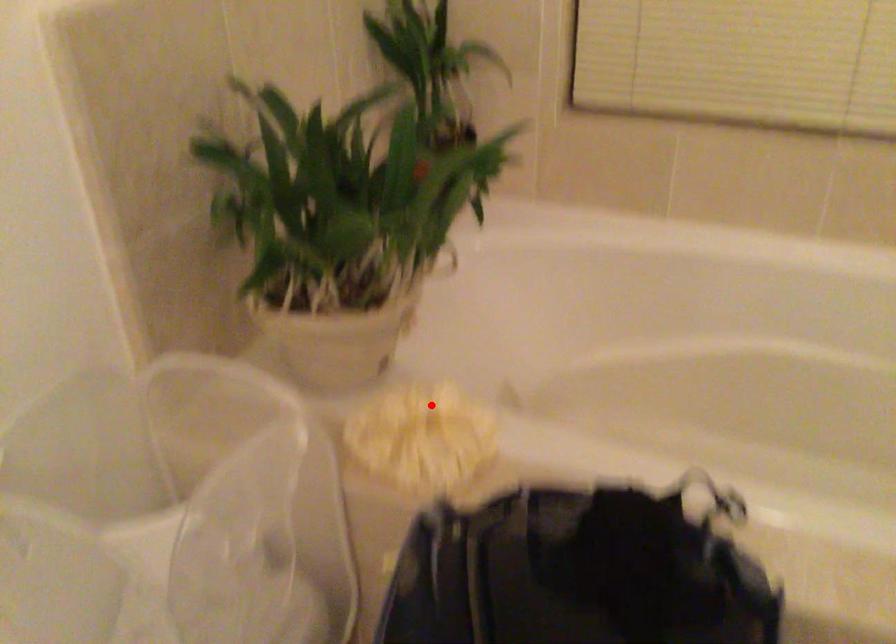
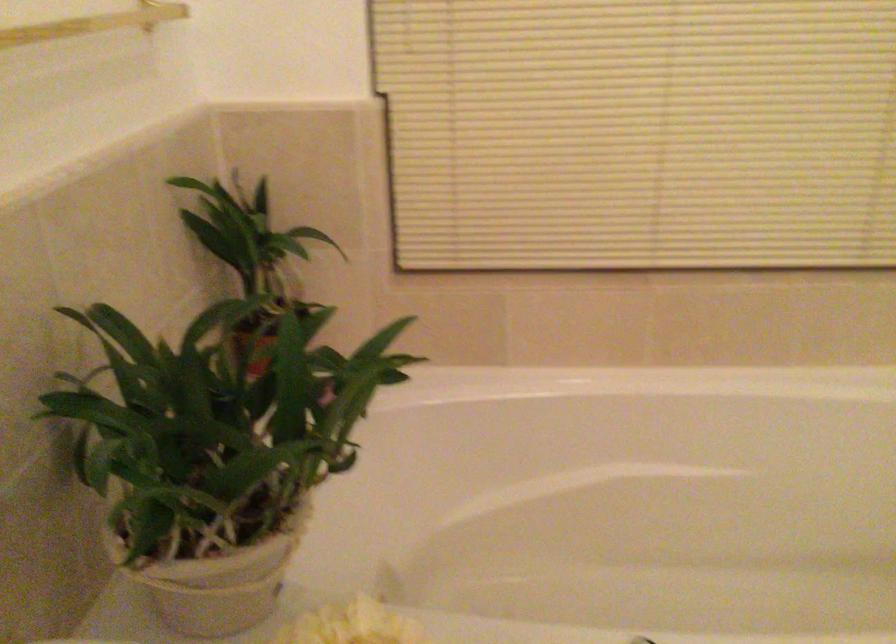
In the second image, find the point that corresponds to the highlighted location in the first image.

(351, 625)